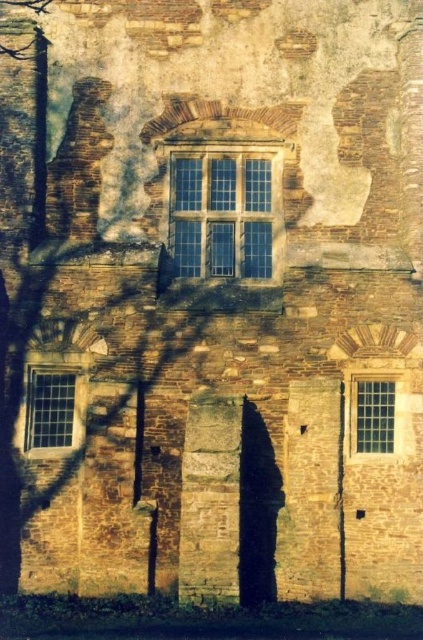
Which of these two, clear glass window at lower left or clear glass window at lower right, stands taller?

With more height is clear glass window at lower left.

Is clear glass window at lower left positioned behind clear glass window at lower right?

Yes, clear glass window at lower left is behind clear glass window at lower right.

Is point (47, 436) more distant than point (371, 406)?

Yes, point (47, 436) is behind point (371, 406).

The image size is (423, 640). I want to click on clear glass window at lower left, so click(49, 410).

Looking at this image, who is positioned more to the left, clear glass window at center or clear glass window at lower left?

clear glass window at lower left is more to the left.

Is the position of clear glass window at center more distant than that of clear glass window at lower left?

Yes.

Is point (203, 212) positioned in front of point (57, 435)?

No, (203, 212) is behind (57, 435).

Where is `clear glass window at center`? clear glass window at center is located at coordinates (222, 212).

From the picture: Does clear glass window at center have a greater width compared to clear glass window at lower right?

Yes.

Which is more to the left, clear glass window at center or clear glass window at lower right?

Positioned to the left is clear glass window at center.

Which is in front, point (271, 180) or point (360, 406)?

Point (360, 406) is in front.

The width and height of the screenshot is (423, 640). I want to click on clear glass window at center, so click(x=222, y=212).